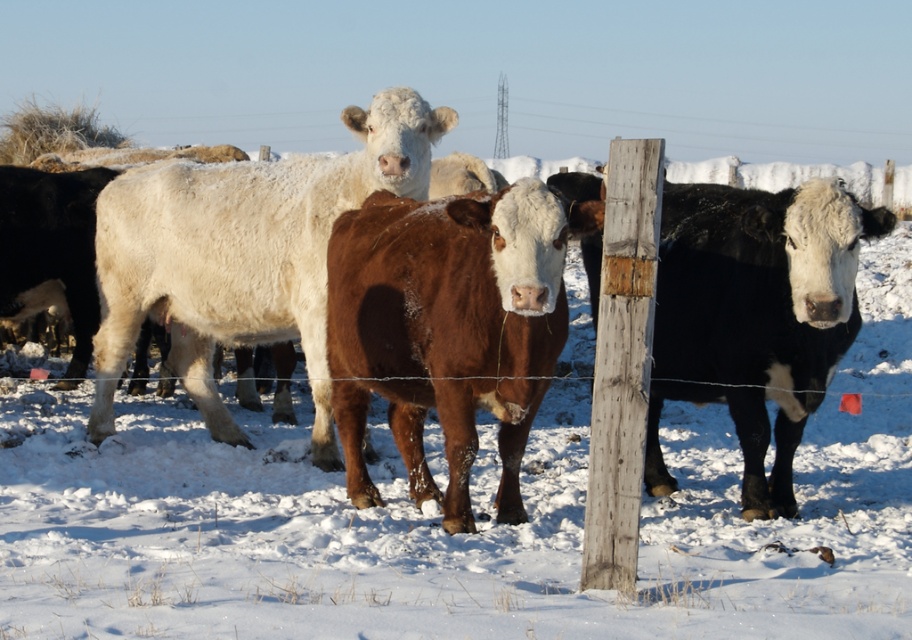
You are a farmer checking the cattle in the snowy pasture. You notice the white woolly bull at center and the black smooth cow at right. Which animal is taller?

The white woolly bull at center is taller than the black smooth cow at right according to the description.

Based on the coordinates provided, where is the white woolly bull at center located in the image?

The white woolly bull at center is located at the coordinates point (244, 253).